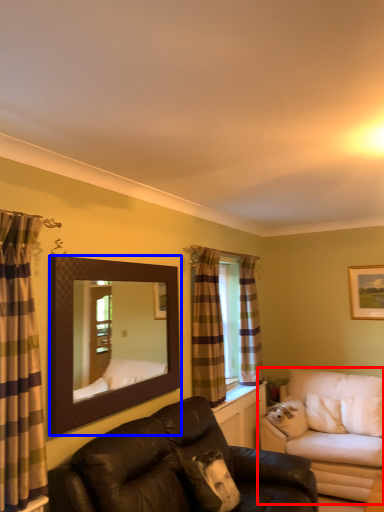
Question: Which point is closer to the camera, studio couch (highlighted by a red box) or mirror (highlighted by a blue box)?

Choices:
 (A) studio couch
 (B) mirror

Answer: (B)